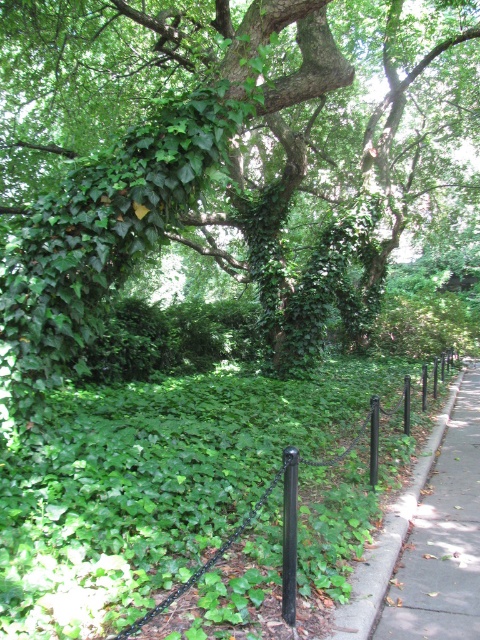
Question: Which object is closer to the camera taking this photo?

Choices:
 (A) gray concrete sidewalk at right
 (B) green leafy tree at center
 (C) black metal fence at center
 (D) black metal pole at center

Answer: (C)

Question: Does gray concrete sidewalk at right have a lesser width compared to black metal fence at center?

Choices:
 (A) no
 (B) yes

Answer: (B)

Question: Among these points, which one is farthest from the camera?

Choices:
 (A) (192, 577)
 (B) (72, 104)
 (C) (434, 624)
 (D) (287, 502)

Answer: (B)

Question: Is gray concrete sidewalk at right smaller than black metal fence at center?

Choices:
 (A) no
 (B) yes

Answer: (B)

Question: Which object appears farthest from the camera in this image?

Choices:
 (A) green leafy tree at center
 (B) gray concrete sidewalk at right
 (C) black metal pole at center
 (D) black metal fence at center

Answer: (B)

Question: Considering the relative positions of gray concrete sidewalk at right and black metal pole at center in the image provided, where is gray concrete sidewalk at right located with respect to black metal pole at center?

Choices:
 (A) above
 (B) below

Answer: (B)